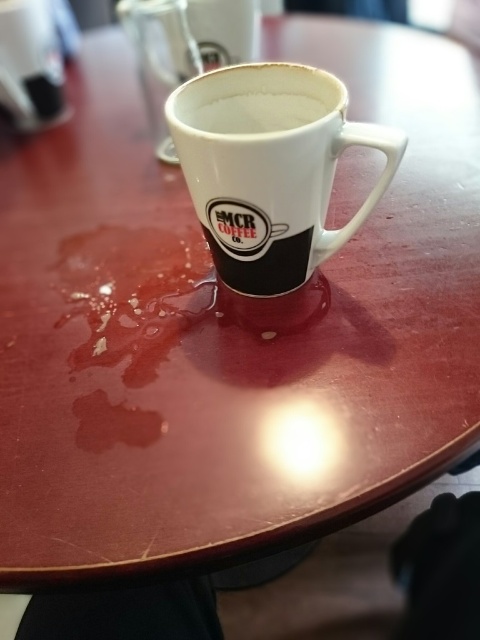
From the picture: You are a barista preparing drinks and need to choose between the white ceramic mug at center and the white matte cup at center for a customer who wants a hot beverage. Which one would you recommend and why?

The white ceramic mug at center has a larger size compared to the white matte cup at center, so it would be better to choose the white ceramic mug at center because it can hold more hot liquid and is more suitable for serving hot beverages.

You are a barista trying to clean up the table. You see the white ceramic mug at center and the white matte cup at center. Which one is taller?

The white ceramic mug at center is taller than the white matte cup at center.